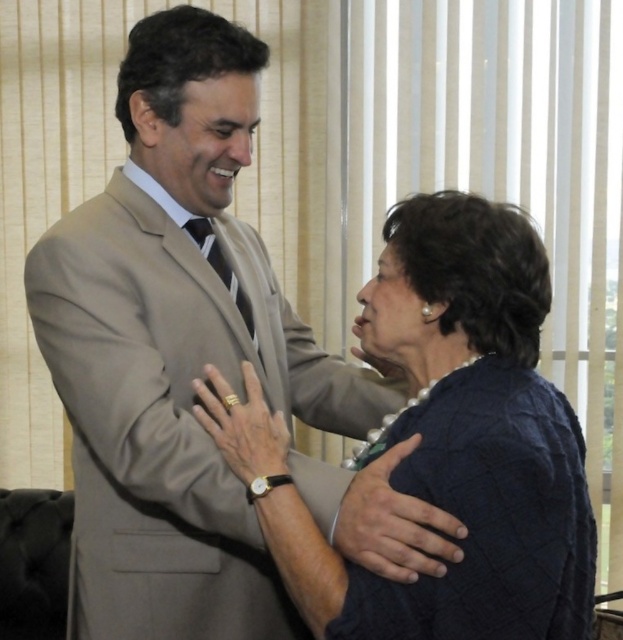
You are a photographer standing at point [164,305]. You want to capture a photo of the two people in the image. Since they are 5.08 feet apart, what is the minimum distance you should set your camera lens to ensure both individuals are in focus?

The minimum distance should be set to 5.08 feet to ensure both individuals are in focus as they are 5.08 feet apart.

You are a photographer trying to capture a clear photo of the dark blue textured sweater at center. However, the light brown suit at center is blocking your view. Can you adjust your position to see the sweater better?

The light brown suit at center is positioned over the dark blue textured sweater at center, so moving your camera position slightly downward or to the side might allow you to see the sweater better without the suit blocking it.